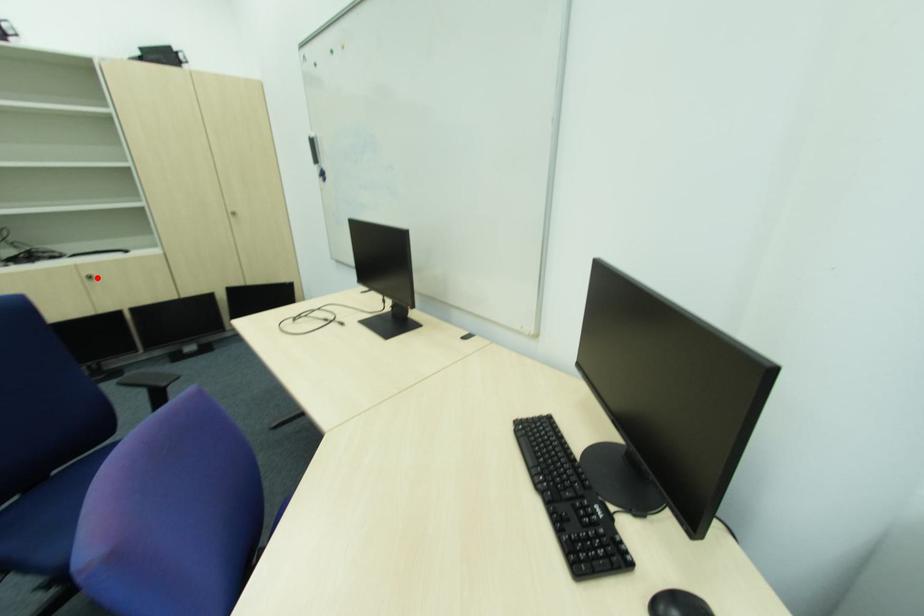
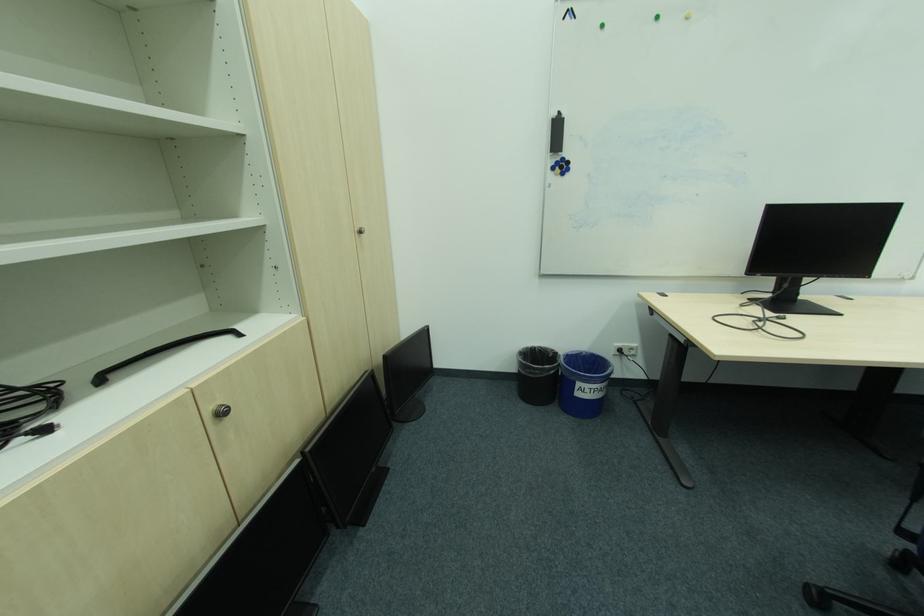
The point at the highlighted location is marked in the first image. Where is the corresponding point in the second image?

(227, 415)